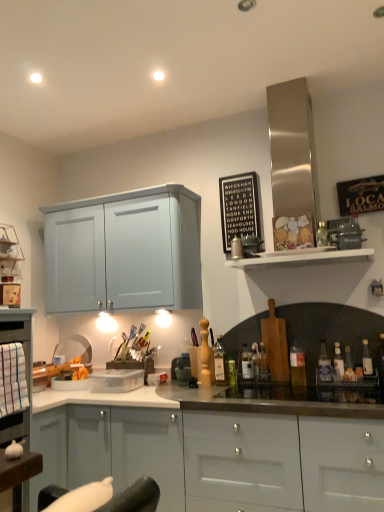
Question: From a real-world perspective, is white wooden shelf at upper right physically located above or below clear glass bottle at right, which is counted as the 4th bottle, starting from the right?

Choices:
 (A) above
 (B) below

Answer: (A)

Question: From the image's perspective, relative to clear glass bottle at right, the seventh bottle positioned from the left, is white wooden shelf at upper right above or below?

Choices:
 (A) above
 (B) below

Answer: (A)

Question: Based on their relative distances, which object is nearer to the white wooden shelf at upper right?

Choices:
 (A) matte gray cabinets at center
 (B) translucent glass bottle at right, positioned as the 3th bottle in left-to-right order
 (C) clear plastic container at center, placed as the 1th appliance when sorted from back to front
 (D) translucent glass bottle at right, which is counted as the fifth bottle, starting from the right
 (E) green glass bottle at center, which is the 9th bottle in right-to-left order

Answer: (D)

Question: Which object is positioned closest to the black wood sign at upper center?

Choices:
 (A) translucent glass bottle at center, the fifth bottle when ordered from left to right
 (B) translucent plastic bottle at right, which appears as the third bottle when viewed from the right
 (C) clear glass bottle at right, acting as the 10th bottle starting from the left
 (D) metallic silver appliance at upper right, which ranks as the 3th appliance in bottom-to-top order
 (E) translucent glass bottle at center, marked as the 4th bottle in a left-to-right arrangement

Answer: (D)